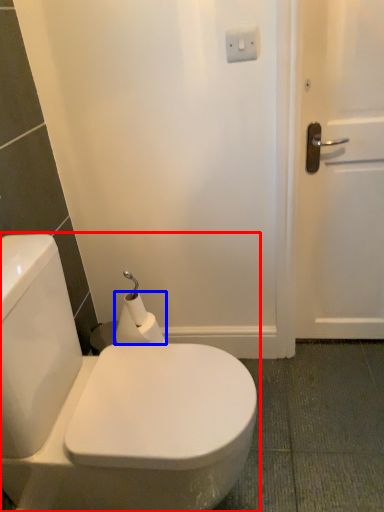
Question: Which point is further to the camera, toilet (highlighted by a red box) or toilet paper (highlighted by a blue box)?

Choices:
 (A) toilet
 (B) toilet paper

Answer: (B)